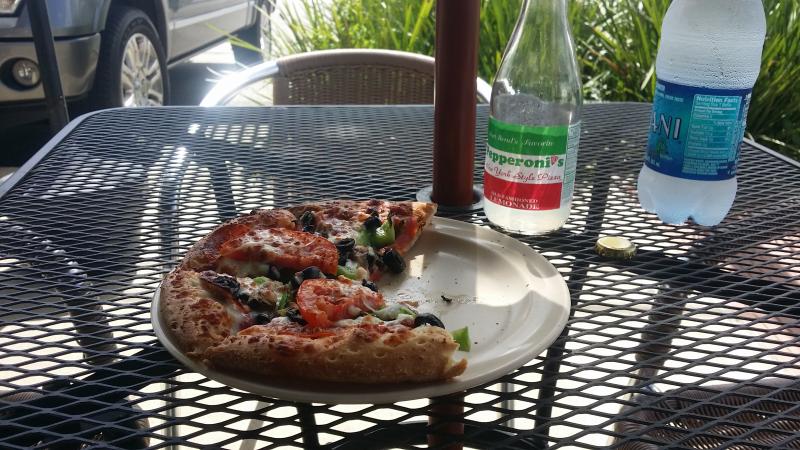
At what (x,y) coordinates should I click in order to perform the action: click on chair. Please return your answer as a coordinate pair (x, y). This screenshot has width=800, height=450. Looking at the image, I should click on (322, 93).